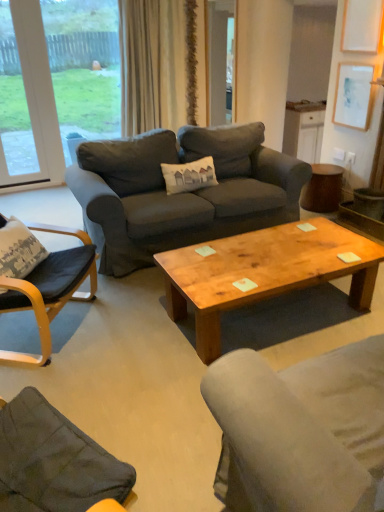
Identify the location of free location to the right of black leather chair at left. This screenshot has height=512, width=384. pyautogui.click(x=129, y=352).